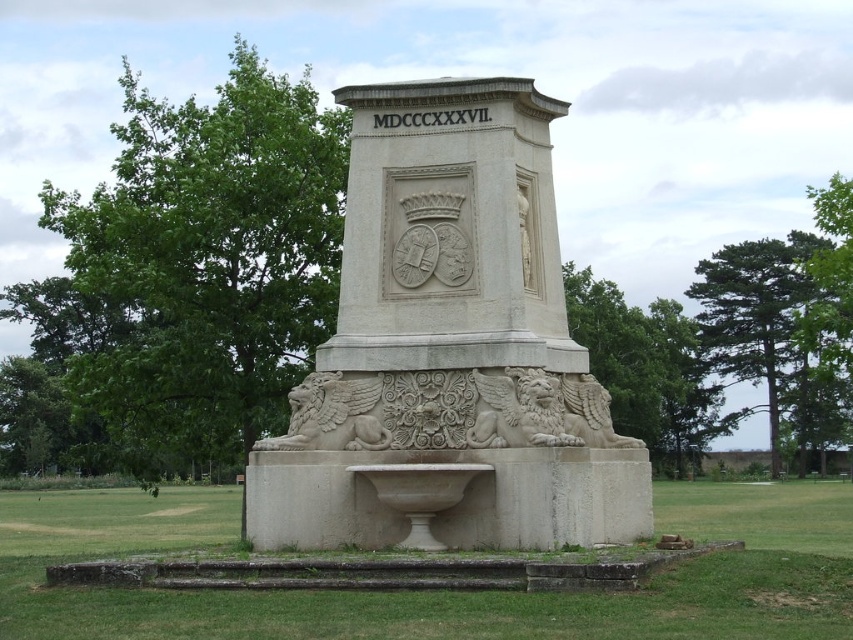
Question: Does white stone monument at center appear on the right side of white stone basin at center?

Choices:
 (A) no
 (B) yes

Answer: (A)

Question: Among these points, which one is nearest to the camera?

Choices:
 (A) (387, 480)
 (B) (476, 630)
 (C) (440, 474)

Answer: (B)

Question: Which object is positioned farthest from the white stone fountain at center?

Choices:
 (A) white stone basin at center
 (B) white stone monument at center

Answer: (B)

Question: Is white stone fountain at center bigger than white stone basin at center?

Choices:
 (A) no
 (B) yes

Answer: (B)

Question: Is white stone fountain at center above white stone basin at center?

Choices:
 (A) no
 (B) yes

Answer: (A)

Question: Among these points, which one is nearest to the camera?

Choices:
 (A) (614, 611)
 (B) (575, 468)
 (C) (403, 291)

Answer: (A)